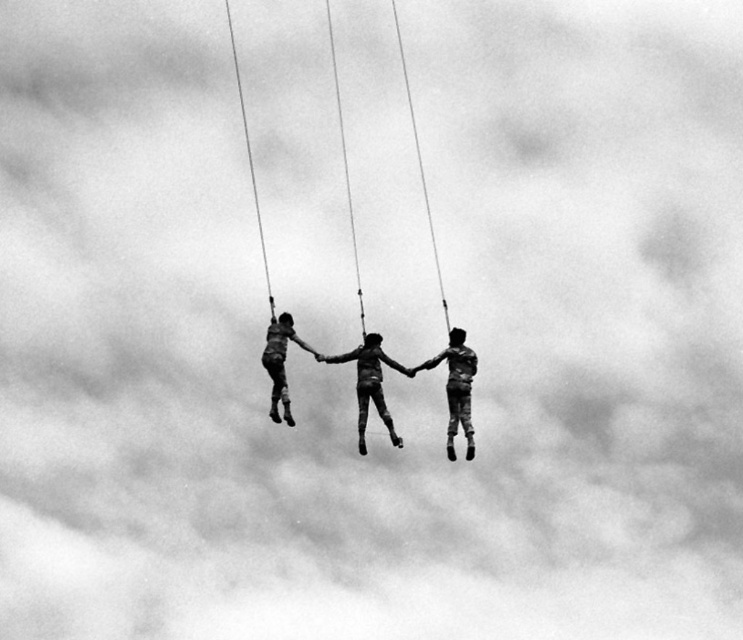
Question: Is smooth fabric couple at center below dark gray fabric person at center?

Choices:
 (A) no
 (B) yes

Answer: (A)

Question: Is smooth fabric couple at center below matte black pants at center?

Choices:
 (A) no
 (B) yes

Answer: (B)

Question: Based on their relative distances, which object is nearer to the smooth fabric pants at center?

Choices:
 (A) matte black pants at center
 (B) dark gray fabric person at center
 (C) smooth fabric couple at center

Answer: (C)

Question: Can you confirm if smooth fabric couple at center is positioned below smooth fabric pants at center?

Choices:
 (A) no
 (B) yes

Answer: (A)

Question: Which object appears closest to the camera in this image?

Choices:
 (A) dark gray fabric person at center
 (B) matte black pants at center
 (C) smooth fabric pants at center
 (D) smooth fabric couple at center

Answer: (C)

Question: Estimate the real-world distances between objects in this image. Which object is closer to the smooth fabric pants at center?

Choices:
 (A) smooth fabric couple at center
 (B) matte black pants at center

Answer: (A)